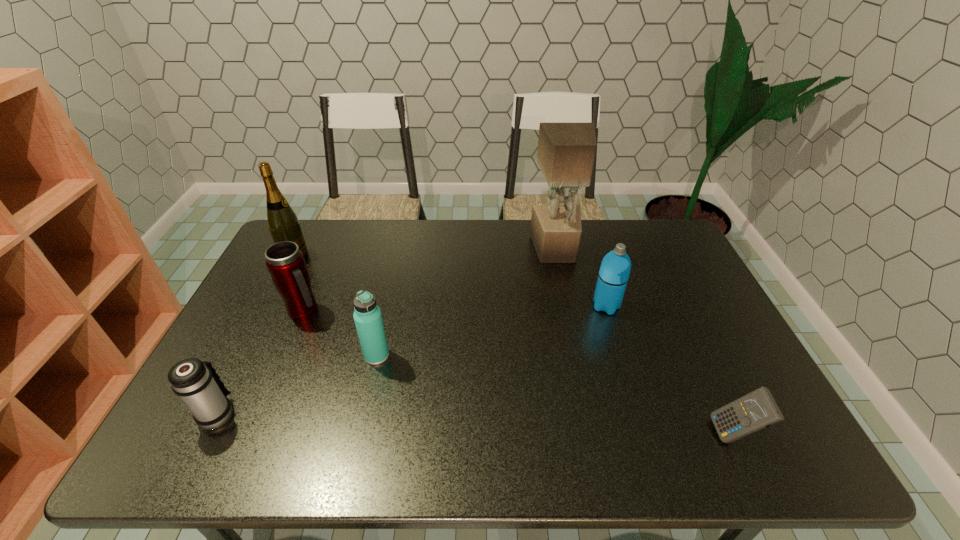
Locate an element on the screen. This screenshot has width=960, height=540. the tallest object is located at coordinates (566, 151).

The width and height of the screenshot is (960, 540). I want to click on wine bottle, so click(x=283, y=223).

Find the location of a particular element. The width and height of the screenshot is (960, 540). the rightmost thermos bottle is located at coordinates (615, 268).

Find the location of a particular element. Image resolution: width=960 pixels, height=540 pixels. the third farthest thermos bottle is located at coordinates (367, 316).

This screenshot has width=960, height=540. In order to click on the third thermos bottle from left to right in this screenshot , I will do `click(367, 316)`.

Locate an element on the screen. This screenshot has height=540, width=960. the third object from left to right is located at coordinates [x=285, y=262].

You are a GUI agent. You are given a task and a screenshot of the screen. Output one action in this format:
    pyautogui.click(x=<x>, y=<y>)
    Task: Click on the nearest thermos bottle
    
    Given the screenshot: What is the action you would take?
    coord(199,386)

This screenshot has width=960, height=540. Find the location of `the sixth tallest object`. the sixth tallest object is located at coordinates (199, 386).

Locate an element on the screen. The width and height of the screenshot is (960, 540). the shortest object is located at coordinates (756, 410).

This screenshot has width=960, height=540. Find the location of `the rightmost object`. the rightmost object is located at coordinates (756, 410).